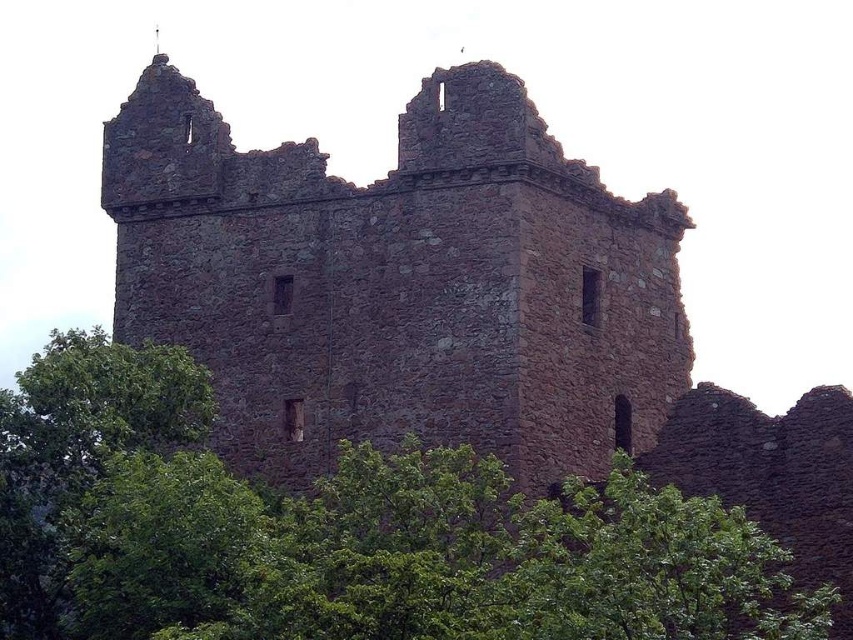
You are standing in front of the ruins of a stone structure. You see two points marked in the image, one at coordinate point (387, 429) and another at point (143, 516). Which of these points is closer to you?

Point (143, 516) is closer to you because it is less further to the camera than point (387, 429).

You are a hiker standing at the base of the brown stone ruins at center and the green leafy tree at center. Which structure do you need to look up more to see the top of?

The brown stone ruins at center is taller than the green leafy tree at center, so you need to look up more to see the top of the brown stone ruins at center.

You are standing at the coordinates 0.5, 0.5 in the image. Which direction should you move to reach the brown stone ruins at center?

The brown stone ruins at center is located at point (399, 282). Since you are at (426, 320), you should move slightly to the left and down to reach it.